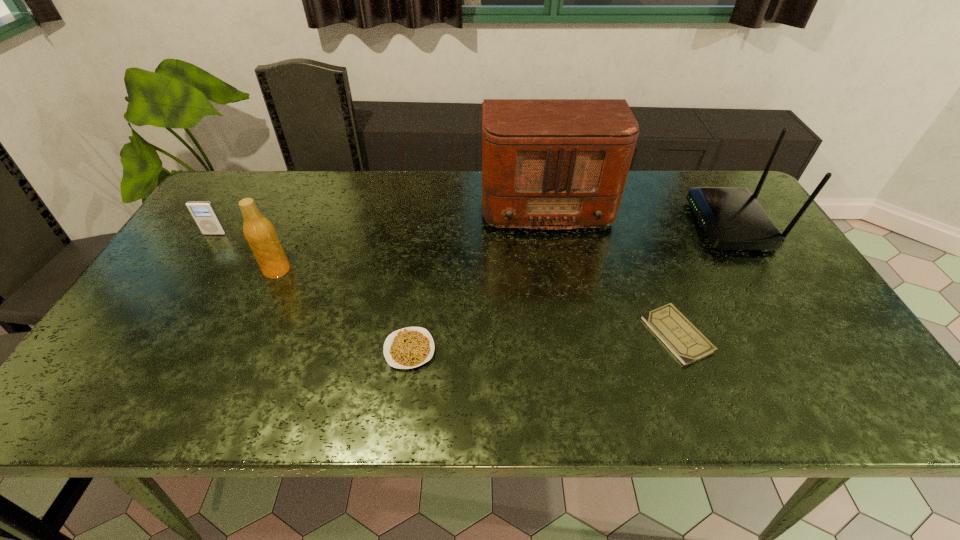
You are a GUI agent. You are given a task and a screenshot of the screen. Output one action in this format:
    pyautogui.click(x=<x>, y=<y>)
    Task: Click on the object situated at the right edge
    
    Given the screenshot: What is the action you would take?
    pyautogui.click(x=732, y=219)

Where is `object situated at the far right corner`? object situated at the far right corner is located at coordinates (732, 219).

The height and width of the screenshot is (540, 960). Find the location of `vacant space at the far edge of the desktop`. vacant space at the far edge of the desktop is located at coordinates (302, 187).

The width and height of the screenshot is (960, 540). I want to click on vacant region at the near edge of the desktop, so click(752, 382).

I want to click on vacant area at the right edge of the desktop, so click(x=788, y=329).

Where is `free space at the far left corner of the desktop`? This screenshot has height=540, width=960. free space at the far left corner of the desktop is located at coordinates (262, 198).

Where is `unoccupied position between the fifth tallest object and the shortest object`? The image size is (960, 540). unoccupied position between the fifth tallest object and the shortest object is located at coordinates [x=543, y=342].

Identify the location of unoccupied area between the third nearest object and the third shortest object. This screenshot has width=960, height=540. (246, 252).

I want to click on empty space that is in between the third nearest object and the checkbook, so click(477, 302).

Identify the location of vacant region between the third nearest object and the leftmost object. (246, 252).